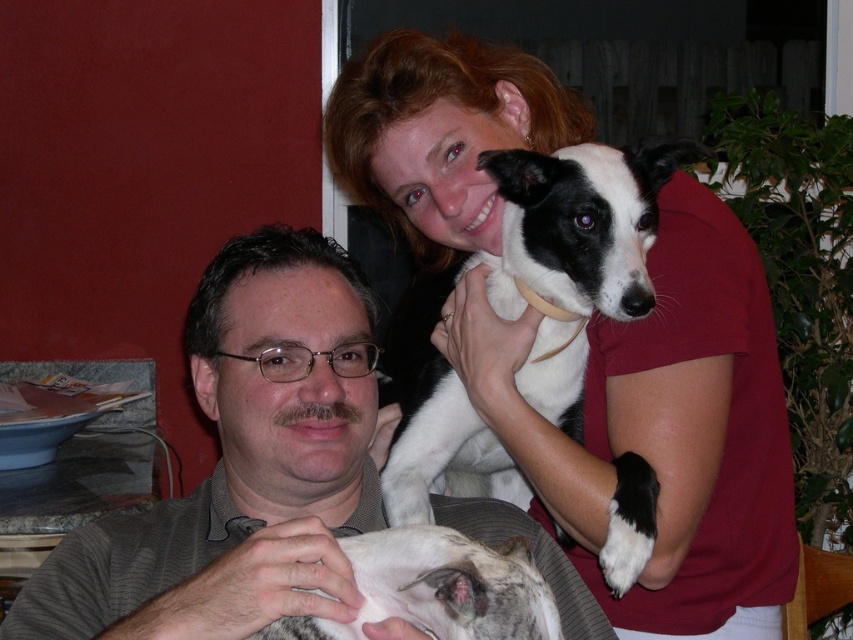
Question: Considering the real-world distances, which object is closest to the black and white fur at upper center?

Choices:
 (A) gray striped shirt at center
 (B) speckled fur dog at lower center

Answer: (A)

Question: Does black and white fur at upper center have a smaller size compared to speckled fur dog at lower center?

Choices:
 (A) no
 (B) yes

Answer: (A)

Question: Which point is farther to the camera?

Choices:
 (A) gray striped shirt at center
 (B) black and white fur at upper center
 (C) speckled fur dog at lower center

Answer: (B)

Question: Is gray striped shirt at center positioned at the back of speckled fur dog at lower center?

Choices:
 (A) no
 (B) yes

Answer: (B)

Question: Does black and white fur at upper center come in front of speckled fur dog at lower center?

Choices:
 (A) no
 (B) yes

Answer: (A)

Question: Which of the following is the farthest from the observer?

Choices:
 (A) gray striped shirt at center
 (B) speckled fur dog at lower center

Answer: (A)